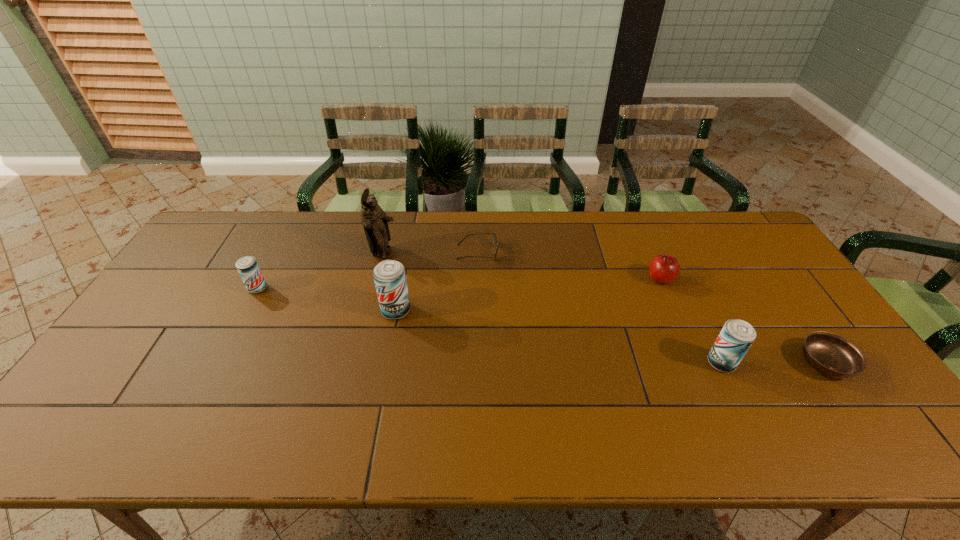
You are a GUI agent. You are given a task and a screenshot of the screen. Output one action in this format:
    pyautogui.click(x=<x>, y=<y>)
    Task: Click on the farthest beer can
    
    Given the screenshot: What is the action you would take?
    pyautogui.click(x=247, y=266)

Locate an element on the screen. The height and width of the screenshot is (540, 960). the shortest beer can is located at coordinates (247, 266).

Locate an element on the screen. The height and width of the screenshot is (540, 960). the second nearest beer can is located at coordinates (389, 276).

Where is `the sixth shortest object`? the sixth shortest object is located at coordinates (389, 276).

You are a GUI agent. You are given a task and a screenshot of the screen. Output one action in this format:
    pyautogui.click(x=<x>, y=<y>)
    Task: Click on the rightmost beer can
    
    Given the screenshot: What is the action you would take?
    pyautogui.click(x=736, y=337)

The height and width of the screenshot is (540, 960). I want to click on the nearest beer can, so click(736, 337).

Identify the location of the tallest object. (375, 221).

Find the location of a particular element. This screenshot has width=960, height=540. sunglasses is located at coordinates (495, 239).

Where is `apple`? The image size is (960, 540). apple is located at coordinates (663, 269).

You are a GUI agent. You are given a task and a screenshot of the screen. Output one action in this format:
    pyautogui.click(x=<x>, y=<y>)
    Task: Click on the soup bowl
    The width and height of the screenshot is (960, 540).
    Given the screenshot: What is the action you would take?
    pyautogui.click(x=832, y=355)